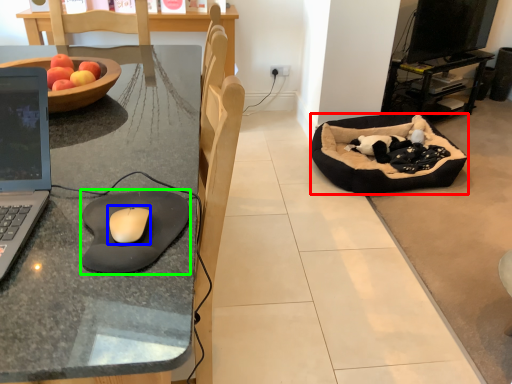
Question: Which object is positioned farthest from dog bed (highlighted by a red box)? Select from mouse (highlighted by a blue box) and mousepad (highlighted by a green box).

Choices:
 (A) mouse
 (B) mousepad

Answer: (A)